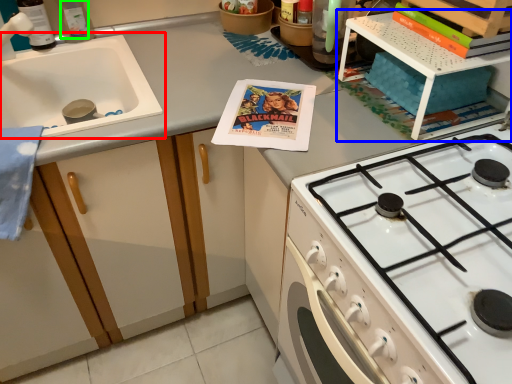
Question: Considering the real-world distances, which object is closest to sink (highlighted by a red box)? shelf (highlighted by a blue box) or bottle (highlighted by a green box).

Choices:
 (A) shelf
 (B) bottle

Answer: (B)